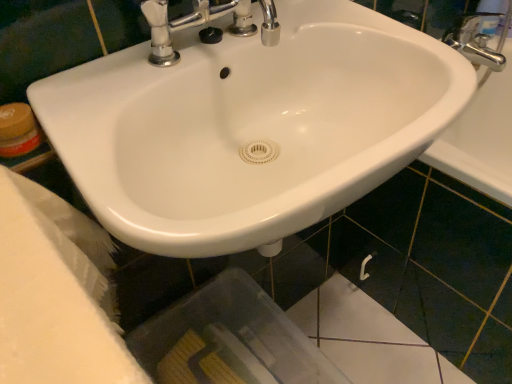
This screenshot has height=384, width=512. I want to click on white glossy sink at center, so click(250, 127).

What do you see at coordinates (250, 127) in the screenshot? I see `white glossy sink at center` at bounding box center [250, 127].

This screenshot has width=512, height=384. I want to click on white glossy sink at center, so click(250, 127).